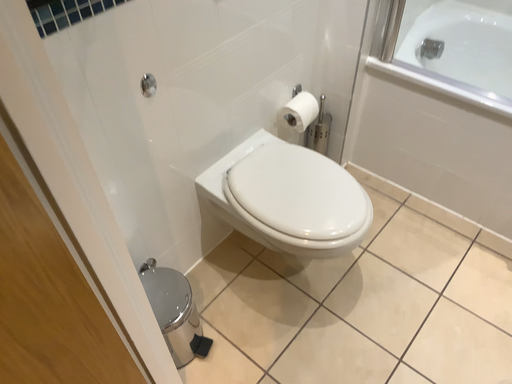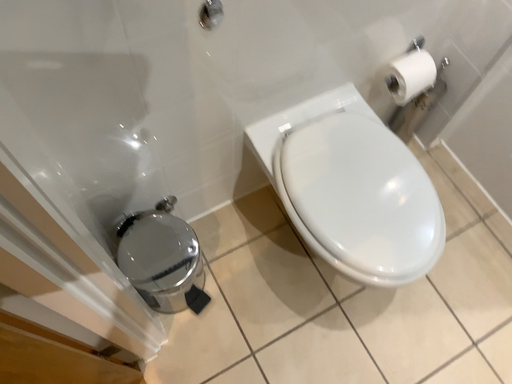
Question: Which way did the camera rotate in the video?

Choices:
 (A) rotated upward
 (B) rotated downward

Answer: (B)